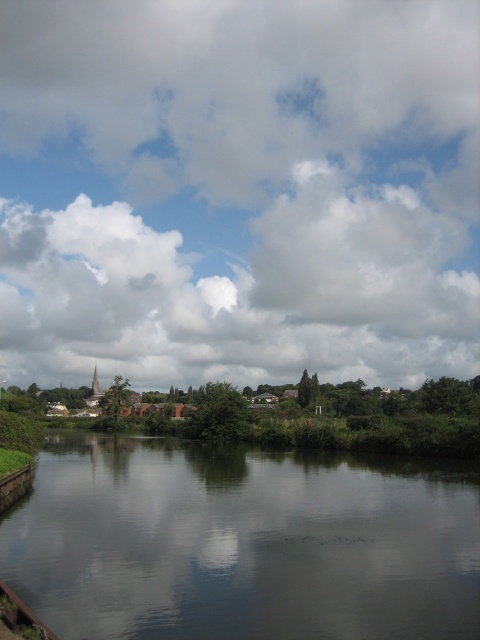
Question: Does cloudy sky at upper center have a lesser width compared to smooth dark water at center?

Choices:
 (A) yes
 (B) no

Answer: (B)

Question: Among these objects, which one is nearest to the camera?

Choices:
 (A) cloudy sky at upper center
 (B) smooth dark water at center

Answer: (B)

Question: Is cloudy sky at upper center to the right of smooth dark water at center from the viewer's perspective?

Choices:
 (A) yes
 (B) no

Answer: (A)

Question: Which point is farther to the camera?

Choices:
 (A) cloudy sky at upper center
 (B) smooth dark water at center

Answer: (A)

Question: Does cloudy sky at upper center have a lesser width compared to smooth dark water at center?

Choices:
 (A) no
 (B) yes

Answer: (A)